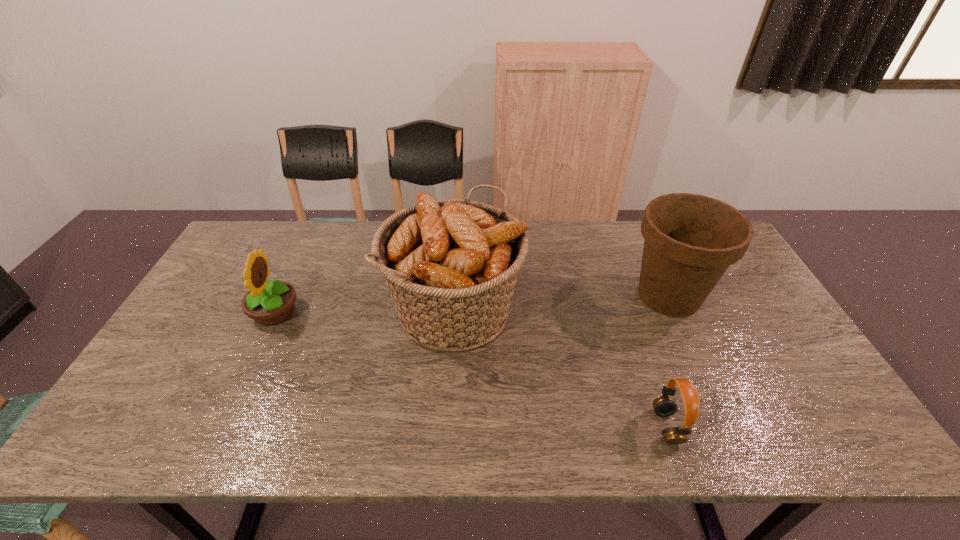
This screenshot has height=540, width=960. Find the location of `basket`. basket is located at coordinates (451, 265).

Locate an element on the screen. This screenshot has width=960, height=540. flowerpot is located at coordinates (690, 240).

Where is `sunflower`? sunflower is located at coordinates (269, 303).

Where is `the leftmost object`? Image resolution: width=960 pixels, height=540 pixels. the leftmost object is located at coordinates (269, 303).

You are a GUI agent. You are given a task and a screenshot of the screen. Output one action in this format:
    pyautogui.click(x=<x>, y=<y>)
    Task: Click on the nearest object
    This screenshot has width=960, height=540.
    Given the screenshot: What is the action you would take?
    pyautogui.click(x=664, y=406)

Locate an element on the screen. headset is located at coordinates (664, 406).

I want to click on free region located 0.130m on the left of the second object from left to right, so click(x=341, y=308).

Locate an element on the screen. The width and height of the screenshot is (960, 540). vacant area situated 0.250m on the back of the flowerpot is located at coordinates 636,222.

Identify the location of free space located 0.150m on the face of the second shortest object. (351, 313).

Identify the location of free space located 0.330m on the ear cups of the nearest object. The height and width of the screenshot is (540, 960). (511, 427).